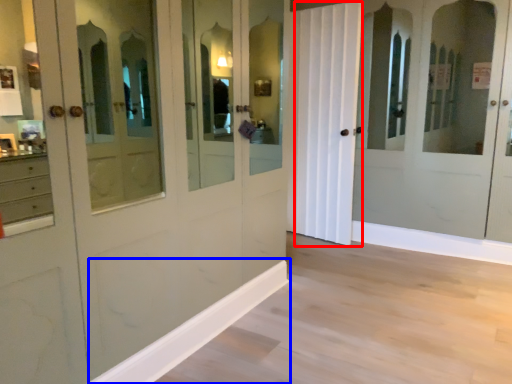
Question: Which object appears closest to the camera in this image, curtain (highlighted by a red box) or molding (highlighted by a blue box)?

Choices:
 (A) curtain
 (B) molding

Answer: (B)